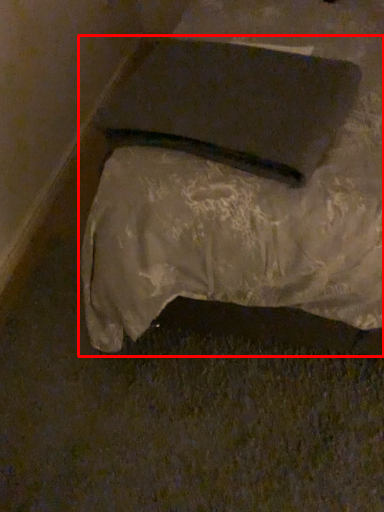
Question: Observing the image, what is the correct spatial positioning of furniture (annotated by the red box) in reference to pad?

Choices:
 (A) left
 (B) right

Answer: (B)